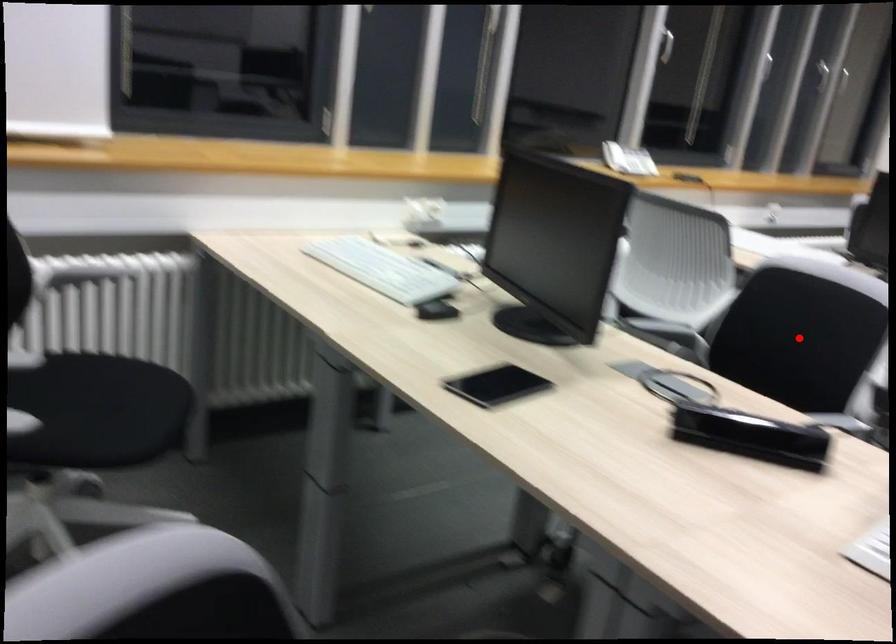
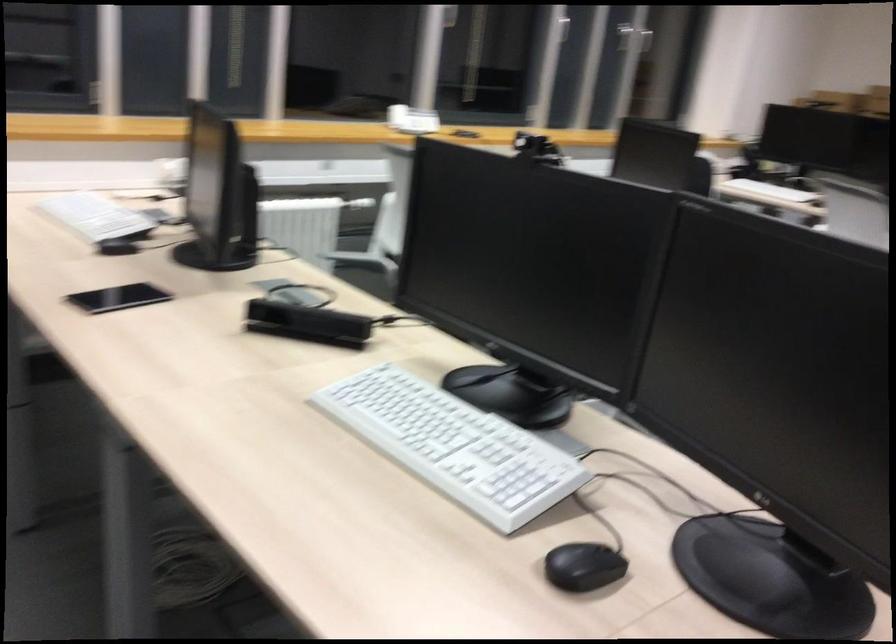
Question: I am providing you with two images of the same scene from different viewpoints. A red point is marked on the first image. Can you still see the location of the red point in image 2?

Choices:
 (A) Yes
 (B) No

Answer: (B)